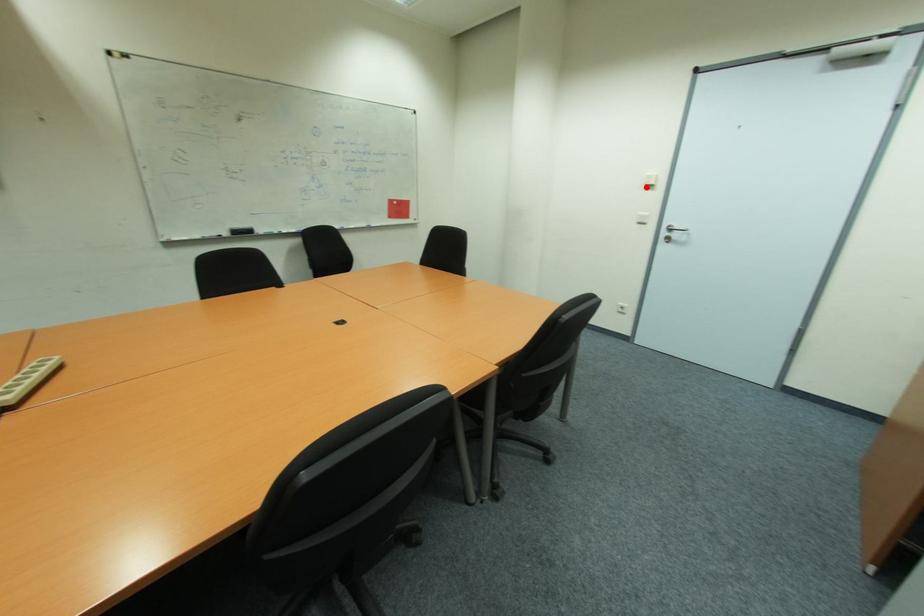
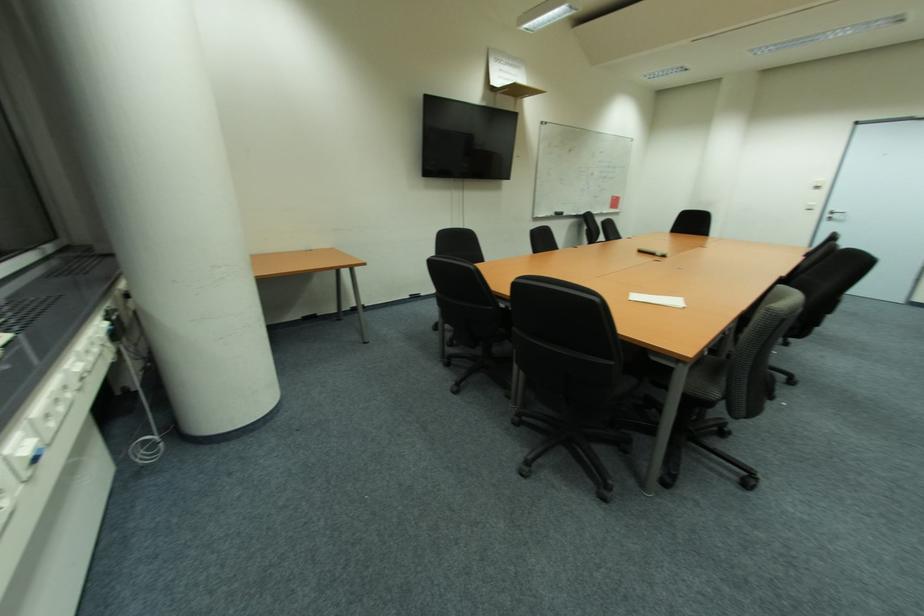
Locate, in the second image, the point that corresponds to the highlighted location in the first image.

(820, 188)